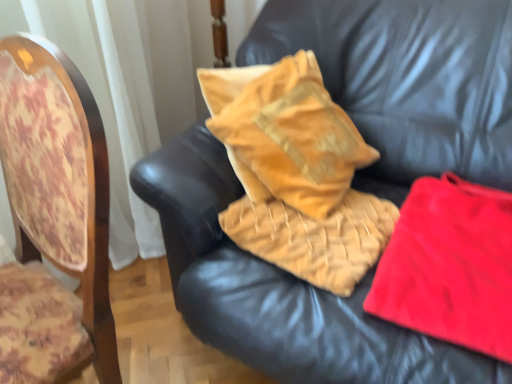
Question: From a real-world perspective, is wooden chair back at left below velvet gold pillow at center, the second material when ordered from right to left?

Choices:
 (A) yes
 (B) no

Answer: (B)

Question: Is wooden chair back at left aimed at velvet gold pillow at center, placed as the first material when sorted from left to right?

Choices:
 (A) no
 (B) yes

Answer: (A)

Question: Is wooden chair back at left looking in the opposite direction of velvet gold pillow at center, placed as the first material when sorted from left to right?

Choices:
 (A) no
 (B) yes

Answer: (A)

Question: Is wooden chair back at left wider than velvet gold pillow at center, placed as the first material when sorted from left to right?

Choices:
 (A) yes
 (B) no

Answer: (B)

Question: Considering the relative positions of wooden chair back at left and velvet gold pillow at center, placed as the first material when sorted from left to right, in the image provided, is wooden chair back at left to the left of velvet gold pillow at center, placed as the first material when sorted from left to right, from the viewer's perspective?

Choices:
 (A) no
 (B) yes

Answer: (B)

Question: Can you confirm if wooden chair back at left is bigger than velvet gold pillow at center, placed as the first material when sorted from left to right?

Choices:
 (A) no
 (B) yes

Answer: (B)

Question: Does velvet gold pillow at center, placed as the first material when sorted from left to right, have a lesser height compared to velvet/yellow pillow at center?

Choices:
 (A) no
 (B) yes

Answer: (B)

Question: From a real-world perspective, is velvet gold pillow at center, the second material when ordered from right to left, physically above velvet/yellow pillow at center?

Choices:
 (A) no
 (B) yes

Answer: (A)

Question: Is velvet/yellow pillow at center surrounded by velvet gold pillow at center, placed as the first material when sorted from left to right?

Choices:
 (A) yes
 (B) no

Answer: (B)

Question: Is velvet gold pillow at center, placed as the first material when sorted from left to right, closer to the viewer compared to velvet/yellow pillow at center?

Choices:
 (A) no
 (B) yes

Answer: (B)

Question: Does velvet gold pillow at center, placed as the first material when sorted from left to right, have a greater width compared to velvet/yellow pillow at center?

Choices:
 (A) yes
 (B) no

Answer: (A)

Question: Does velvet gold pillow at center, the second material when ordered from right to left, have a lesser width compared to velvet/yellow pillow at center?

Choices:
 (A) no
 (B) yes

Answer: (A)

Question: Could you tell me if velvet/yellow pillow at center is turned towards red fleece blanket at right, the 1th material viewed from the right?

Choices:
 (A) no
 (B) yes

Answer: (B)